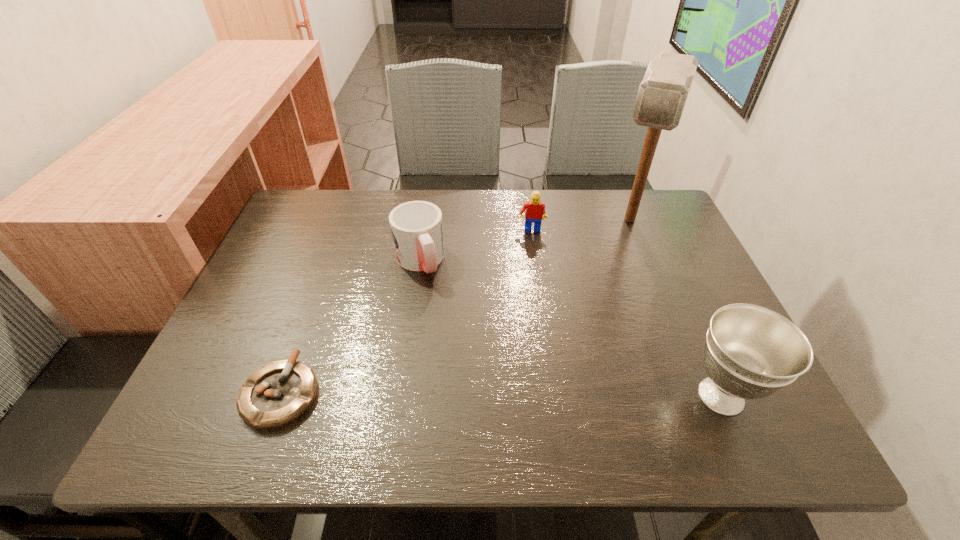
The width and height of the screenshot is (960, 540). Identify the location of free point between the third object from left to right and the shortest object. (406, 312).

This screenshot has height=540, width=960. Identify the location of free point between the chalice and the mug. (570, 328).

The image size is (960, 540). I want to click on free spot between the tallest object and the second tallest object, so click(675, 308).

Find the location of a particular element. The image size is (960, 540). empty space between the Lego and the chalice is located at coordinates (626, 313).

Locate an element on the screen. The image size is (960, 540). the second closest object relative to the third object from left to right is located at coordinates (417, 229).

Locate which object is the closest to the mallet. Please provide its 2D coordinates. Your answer should be formatted as a tuple, i.e. [(x, y)], where the tuple contains the x and y coordinates of a point satisfying the conditions above.

[(535, 210)]

Where is `vacant point that satisfies the following two spatial constraints: 1. on the back side of the fourth object from right to left; 2. on the right side of the leftmost object`? vacant point that satisfies the following two spatial constraints: 1. on the back side of the fourth object from right to left; 2. on the right side of the leftmost object is located at coordinates (329, 261).

The height and width of the screenshot is (540, 960). In order to click on vacant region that satisfies the following two spatial constraints: 1. on the front side of the fourth shortest object; 2. on the left side of the mug in this screenshot , I will do `click(399, 396)`.